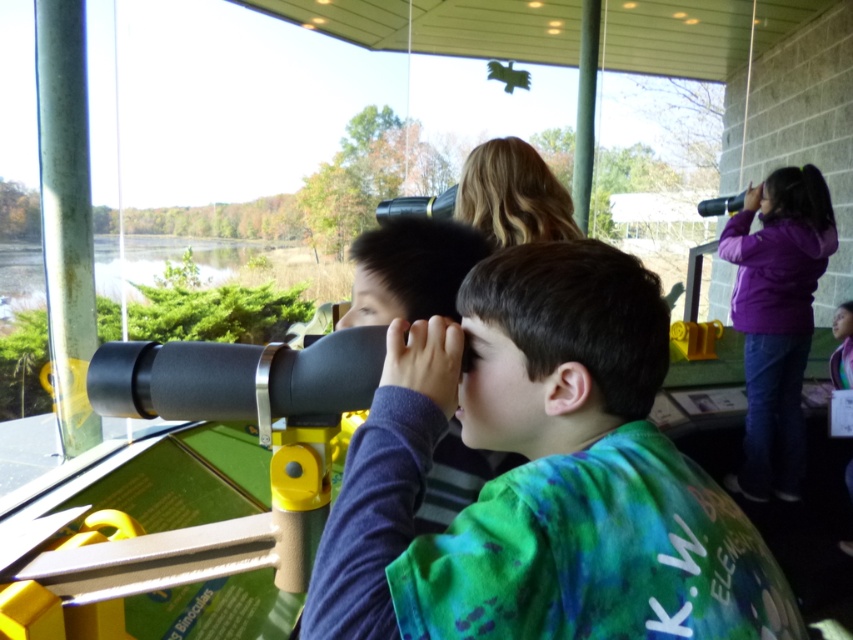
Consider the image. Does matte black telescope at center have a greater width compared to matte black binoculars at center?

Yes, matte black telescope at center is wider than matte black binoculars at center.

Which is behind, point (503, 524) or point (380, 276)?

Positioned behind is point (380, 276).

Between point (509, 484) and point (460, 282), which one is positioned in front?

Point (509, 484) is in front.

The width and height of the screenshot is (853, 640). I want to click on matte black telescope at center, so click(x=543, y=477).

Does matte black telescope at center have a greater height compared to purple fleece jacket at right?

No.

Is point (589, 573) more distant than point (799, 305)?

No, (589, 573) is closer to viewer.

Where is `matte black telescope at center`? Image resolution: width=853 pixels, height=640 pixels. matte black telescope at center is located at coordinates (543, 477).

Does purple fleece jacket at right have a greater width compared to matte black binoculars at center?

Correct, the width of purple fleece jacket at right exceeds that of matte black binoculars at center.

Who is shorter, purple fleece jacket at right or matte black binoculars at center?

With less height is matte black binoculars at center.

This screenshot has height=640, width=853. Identify the location of purple fleece jacket at right. (776, 320).